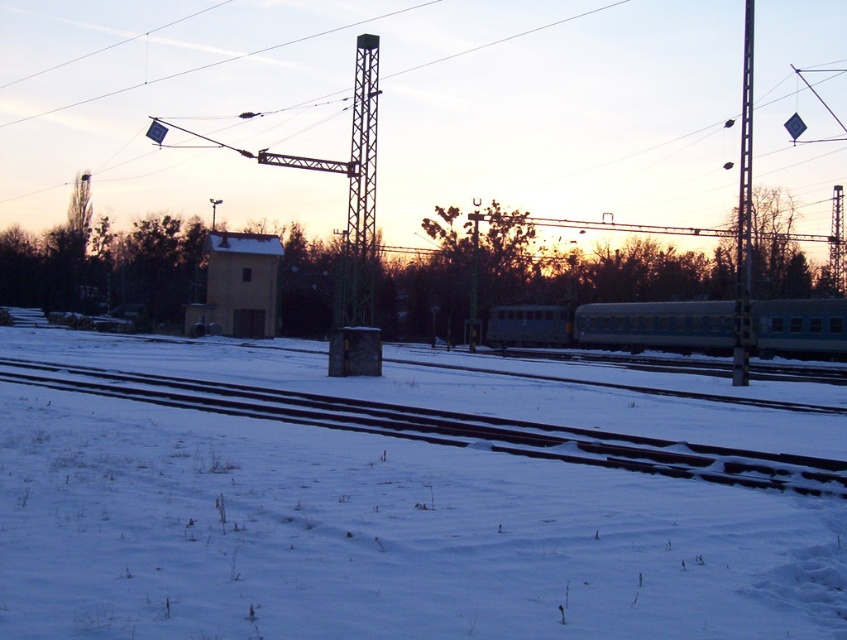
You are a maintenance worker at the railway station. You need to attach a safety sign to the taller structure between the metallic tower at center and the metallic pole at right. Which structure should you choose?

The metallic pole at right is taller than the metallic tower at center, so you should attach the safety sign to the metallic pole at right.

You are standing at the center of the railway station and want to walk towards the smooth steel tracks at lower center. According to the coordinates provided, in which direction should you move from your current position?

You should move towards the point at coordinates 0.669 on the x axis and 0.530 on the y axis to reach the smooth steel tracks at lower center.